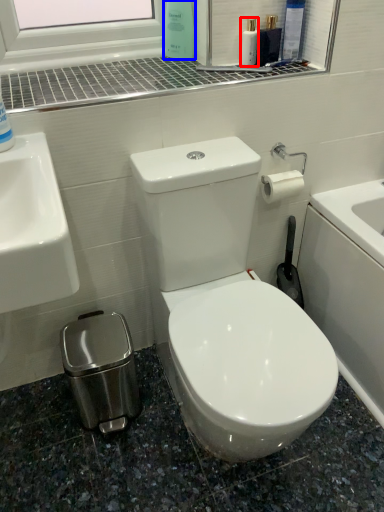
Question: Among these objects, which one is nearest to the camera, mouthwash (highlighted by a red box) or cleaning product (highlighted by a blue box)?

Choices:
 (A) mouthwash
 (B) cleaning product

Answer: (A)